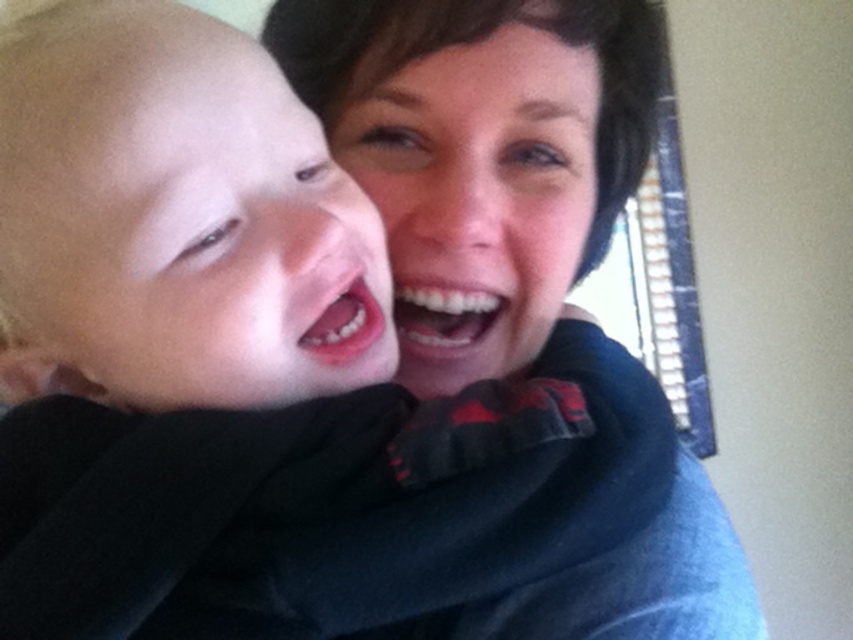
You are a photographer trying to capture a portrait of the two people in the image. You need to ensure that both the smooth skin face at left and the matte black scarf at center are clearly visible in the frame. Based on their positions, which object should you focus on first to ensure both are in focus?

The smooth skin face at left is to the left of the matte black scarf at center. To ensure both are in focus, you should focus on the matte black scarf at center since it is closer to the center of the frame, allowing the depth of field to cover both objects effectively.

You are a photographer adjusting the lighting in the scene. You need to ensure that the matte black sweater at upper center and the smooth skin face at left are both well lit. Which object should you focus the light on first to ensure proper exposure?

The smooth skin face at left should be focused on first because the matte black sweater at upper center is located below it, and adjusting the lighting for the face will naturally illuminate the sweater as well.

You are a photographer setting up for a family photo. You need to ensure that the smooth skin baby at left and the matte black sweater at upper center are both clearly visible in the frame. Given their height difference, where should you position the camera to capture both effectively?

Since the smooth skin baby at left is shorter than the matte black sweater at upper center, positioning the camera at a lower angle will ensure both are visible. This way, the baby can be seen without being blocked by the sweater, and the sweater remains in frame.